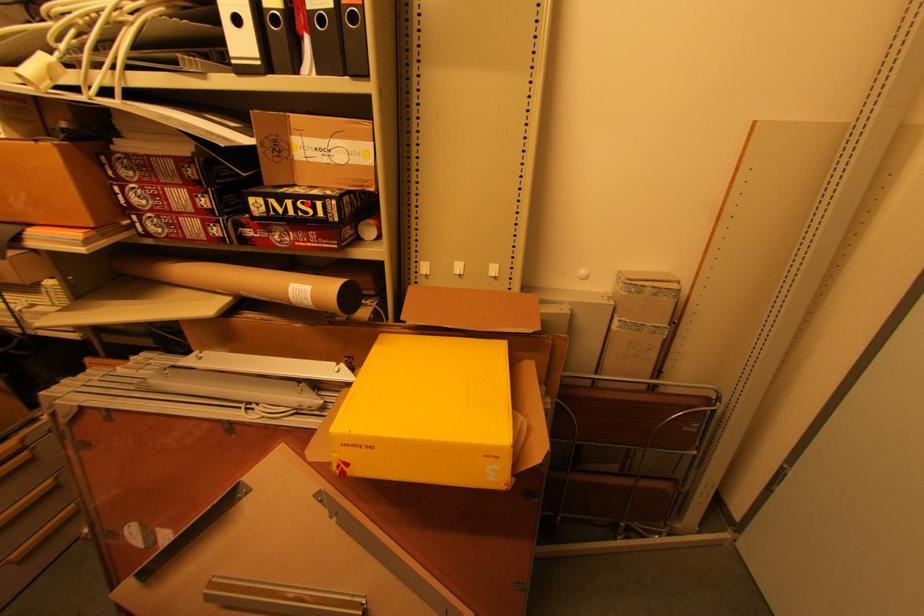
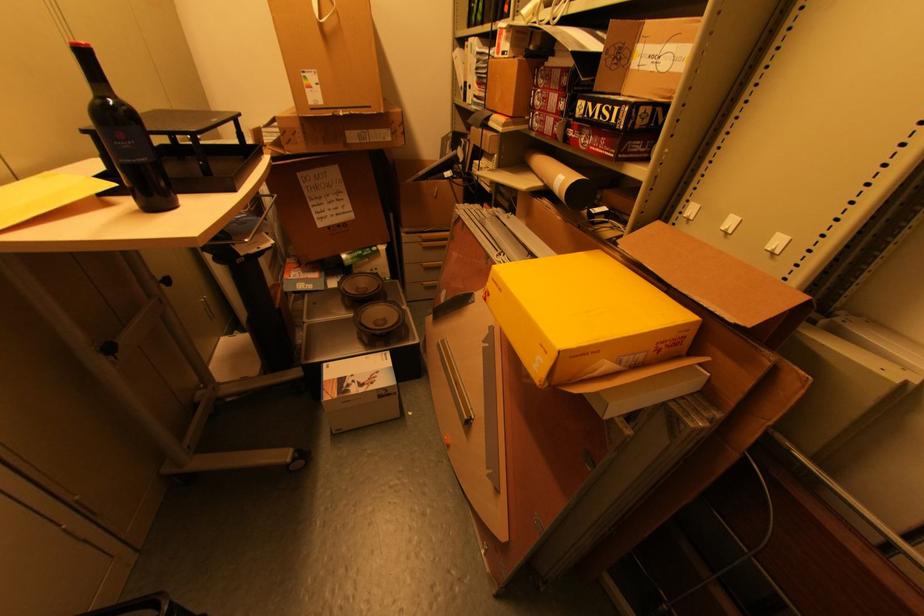
Question: I am providing you with two images of the same scene from different viewpoints. A red point is marked on the first image. Is the red point's position out of view in image 2?

Choices:
 (A) Yes
 (B) No

Answer: (B)